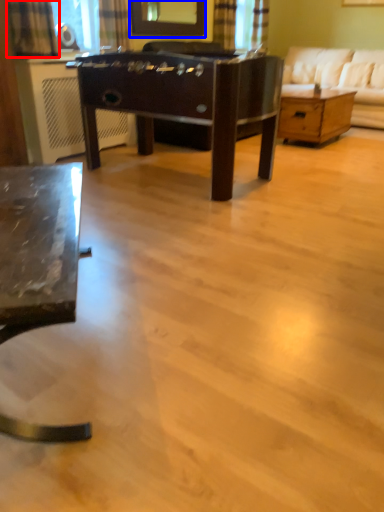
Question: Which object appears closest to the camera in this image, curtain (highlighted by a red box) or mirror (highlighted by a blue box)?

Choices:
 (A) curtain
 (B) mirror

Answer: (A)